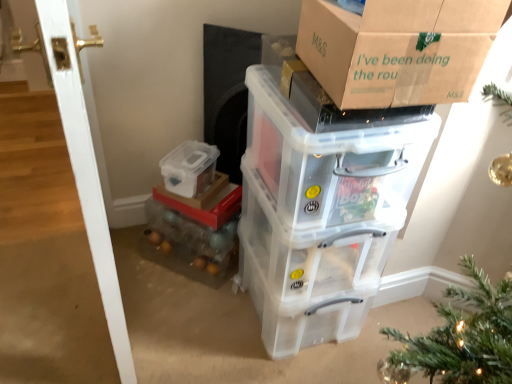
Where is `vacant point to the right of white glossy door at left`? vacant point to the right of white glossy door at left is located at coordinates (173, 319).